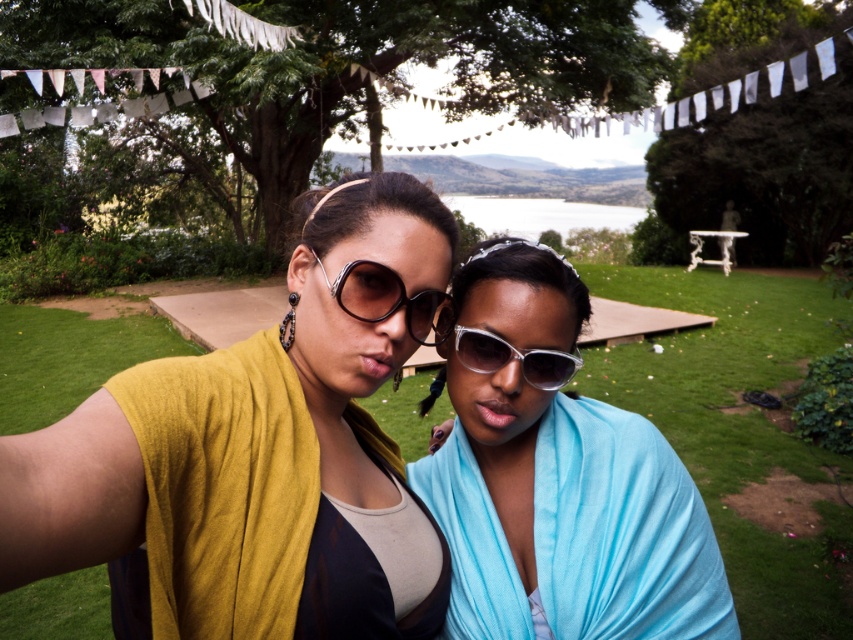
Can you confirm if mustard yellow cardigan at center is taller than translucent white sunglasses at center?

Yes.

Who is more distant from viewer, (x=299, y=576) or (x=498, y=564)?

Point (x=498, y=564)

Where is `mustard yellow cardigan at center`? The image size is (853, 640). mustard yellow cardigan at center is located at coordinates (260, 449).

Can you confirm if translucent white sunglasses at center is positioned below matte black sunglasses at center?

Yes, translucent white sunglasses at center is below matte black sunglasses at center.

Image resolution: width=853 pixels, height=640 pixels. What do you see at coordinates (556, 477) in the screenshot? I see `translucent white sunglasses at center` at bounding box center [556, 477].

Is point (517, 260) more distant than point (434, 298)?

Yes, it is behind point (434, 298).

Find the location of a particular element. This screenshot has height=640, width=853. translucent white sunglasses at center is located at coordinates (556, 477).

Who is shorter, translucent white sunglasses at center or transparent plastic sunglasses at center?

transparent plastic sunglasses at center is shorter.

Is point (677, 531) in front of point (550, 388)?

No, (677, 531) is further to viewer.

Is point (596, 616) farther from viewer compared to point (489, 333)?

Yes, point (596, 616) is behind point (489, 333).

This screenshot has width=853, height=640. What are the coordinates of `translucent white sunglasses at center` in the screenshot? It's located at (556, 477).